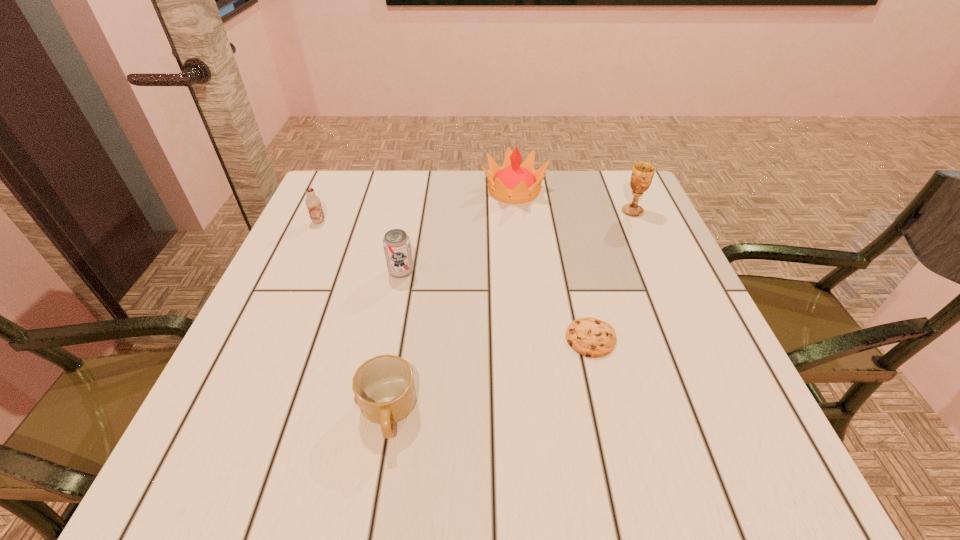
This screenshot has height=540, width=960. Identify the location of vacant space that satisfies the following two spatial constraints: 1. on the back side of the chalice; 2. on the right side of the beer can. (413, 211).